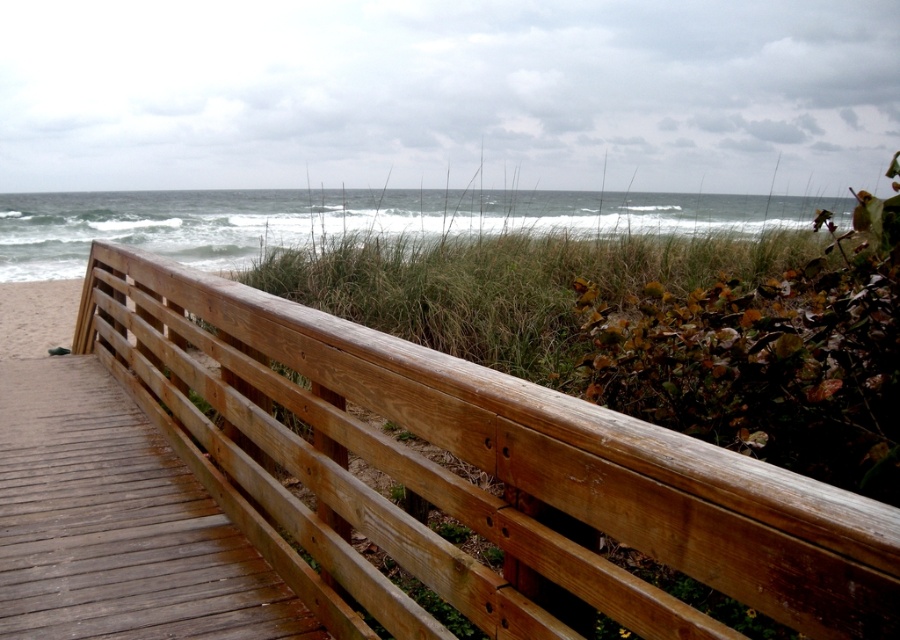
Question: Is natural wood rail at center wider than weathered wood boardwalk at lower left?

Choices:
 (A) yes
 (B) no

Answer: (A)

Question: Is natural wood rail at center below weathered wood boardwalk at lower left?

Choices:
 (A) no
 (B) yes

Answer: (A)

Question: Can you confirm if natural wood rail at center is positioned to the right of weathered wood boardwalk at lower left?

Choices:
 (A) yes
 (B) no

Answer: (A)

Question: Which point is closer to the camera taking this photo?

Choices:
 (A) (398, 625)
 (B) (63, 432)

Answer: (A)

Question: Which object appears farthest from the camera in this image?

Choices:
 (A) natural wood rail at center
 (B) weathered wood boardwalk at lower left

Answer: (B)